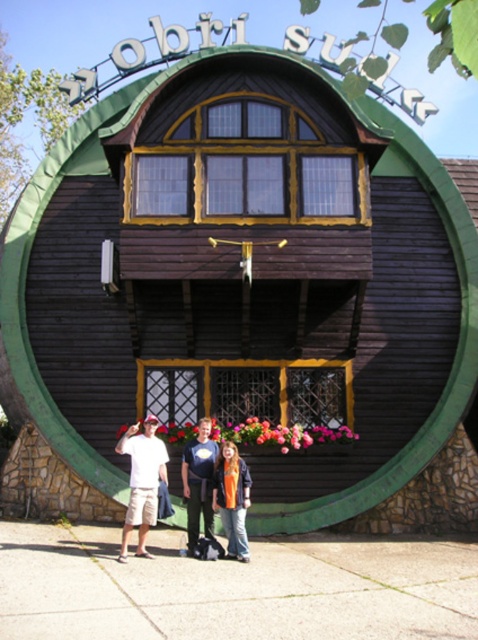
Is white cotton shirt at center below dark blue t-shirt at center?

Incorrect, white cotton shirt at center is not positioned below dark blue t-shirt at center.

Does white cotton shirt at center come in front of dark blue t-shirt at center?

Yes, it is.

This screenshot has width=478, height=640. What do you see at coordinates (141, 481) in the screenshot?
I see `white cotton shirt at center` at bounding box center [141, 481].

You are a GUI agent. You are given a task and a screenshot of the screen. Output one action in this format:
    pyautogui.click(x=<x>, y=<y>)
    Task: Click on the white cotton shirt at center
    This screenshot has height=640, width=478.
    Given the screenshot: What is the action you would take?
    pyautogui.click(x=141, y=481)

From the picture: Does white cotton shirt at center have a lesser width compared to orange fabric jacket at center?

No, white cotton shirt at center is not thinner than orange fabric jacket at center.

Is point (148, 488) behind point (232, 444)?

That is False.

Locate an element on the screen. white cotton shirt at center is located at coordinates (141, 481).

Does white cotton t-shirt at center have a smaller size compared to dark blue t-shirt at center?

Actually, white cotton t-shirt at center might be larger than dark blue t-shirt at center.

Which is more to the left, white cotton t-shirt at center or dark blue t-shirt at center?

From the viewer's perspective, white cotton t-shirt at center appears more on the left side.

The image size is (478, 640). Find the location of `white cotton t-shirt at center`. white cotton t-shirt at center is located at coordinates (142, 481).